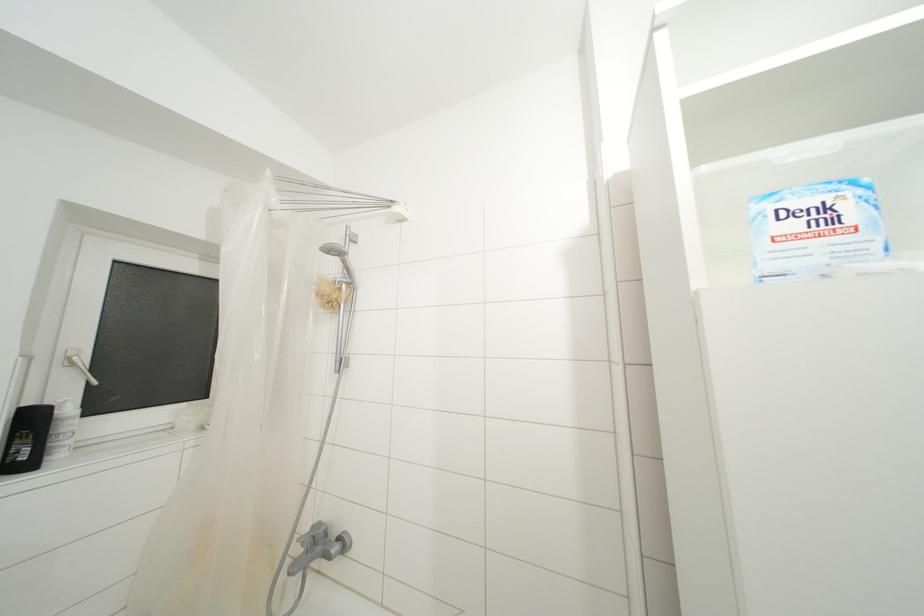
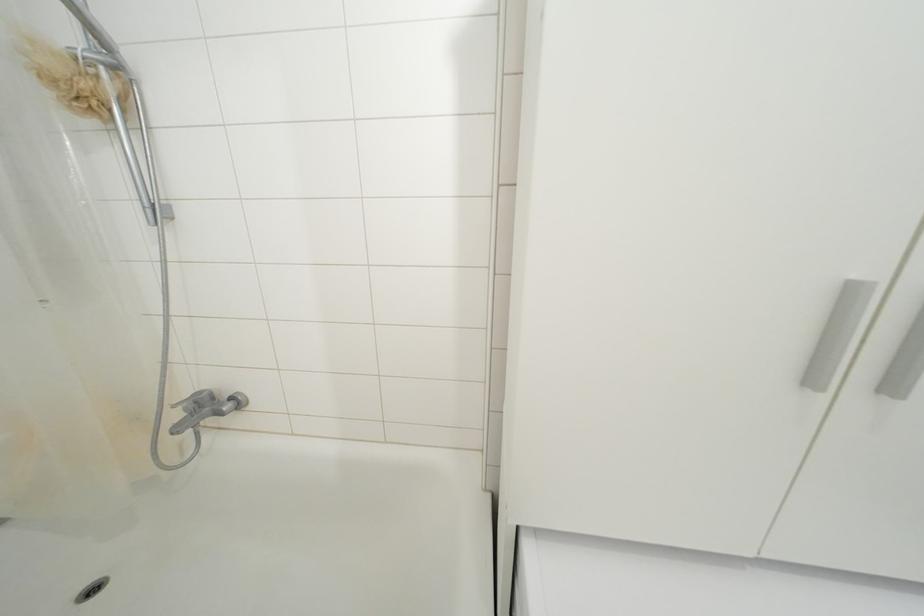
Find the pixel in the second image that matches (344,294) in the first image.

(100, 79)